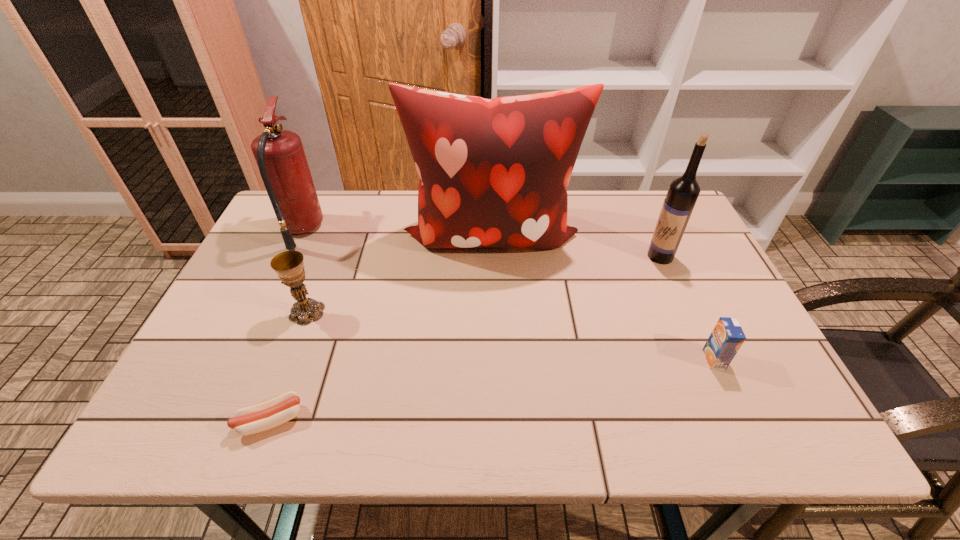
Where is `object that is at the near edge`? object that is at the near edge is located at coordinates (264, 416).

Locate an element on the screen. The height and width of the screenshot is (540, 960). fire extinguisher present at the left edge is located at coordinates (282, 163).

Find the location of a particular element. sausage present at the left edge is located at coordinates (264, 416).

In order to click on wine bottle that is at the right edge in this screenshot , I will do `click(683, 192)`.

This screenshot has width=960, height=540. I want to click on orange_juice that is at the right edge, so click(x=727, y=337).

Identify the location of object that is at the far left corner. The width and height of the screenshot is (960, 540). (282, 163).

Where is `object positioned at the near left corner`? This screenshot has width=960, height=540. object positioned at the near left corner is located at coordinates (264, 416).

The height and width of the screenshot is (540, 960). I want to click on vacant area at the far edge, so click(615, 198).

The height and width of the screenshot is (540, 960). In the image, there is a desktop. Find the location of `vacant space at the near edge`. vacant space at the near edge is located at coordinates coord(352,430).

Image resolution: width=960 pixels, height=540 pixels. In the image, there is a desktop. Find the location of `vacant area at the right edge`. vacant area at the right edge is located at coordinates (744, 378).